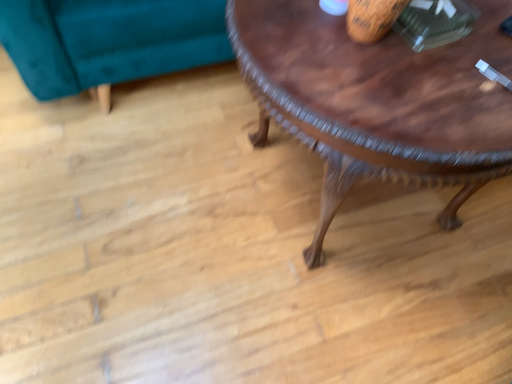
Question: Should I look upward or downward to see wooden carved coffee table at center?

Choices:
 (A) down
 (B) up

Answer: (B)

Question: Considering the relative sizes of wooden carved coffee table at center and teal velvet swivel chair at upper left in the image provided, is wooden carved coffee table at center taller than teal velvet swivel chair at upper left?

Choices:
 (A) yes
 (B) no

Answer: (A)

Question: Is wooden carved coffee table at center looking in the opposite direction of teal velvet swivel chair at upper left?

Choices:
 (A) no
 (B) yes

Answer: (B)

Question: Is wooden carved coffee table at center at the left side of teal velvet swivel chair at upper left?

Choices:
 (A) yes
 (B) no

Answer: (B)

Question: From a real-world perspective, is wooden carved coffee table at center under teal velvet swivel chair at upper left?

Choices:
 (A) no
 (B) yes

Answer: (A)

Question: Could you tell me if wooden carved coffee table at center is turned towards teal velvet swivel chair at upper left?

Choices:
 (A) yes
 (B) no

Answer: (B)

Question: Does wooden carved coffee table at center have a lesser height compared to teal velvet swivel chair at upper left?

Choices:
 (A) yes
 (B) no

Answer: (B)

Question: Is teal velvet swivel chair at upper left turned away from wooden carved coffee table at center?

Choices:
 (A) no
 (B) yes

Answer: (A)

Question: Is the position of teal velvet swivel chair at upper left more distant than that of wooden carved coffee table at center?

Choices:
 (A) no
 (B) yes

Answer: (B)

Question: Is teal velvet swivel chair at upper left taller than wooden carved coffee table at center?

Choices:
 (A) no
 (B) yes

Answer: (A)

Question: Does teal velvet swivel chair at upper left turn towards wooden carved coffee table at center?

Choices:
 (A) no
 (B) yes

Answer: (B)

Question: Does teal velvet swivel chair at upper left appear on the left side of wooden carved coffee table at center?

Choices:
 (A) no
 (B) yes

Answer: (B)

Question: Is teal velvet swivel chair at upper left bigger than wooden carved coffee table at center?

Choices:
 (A) yes
 (B) no

Answer: (B)

Question: Does point (12, 29) appear closer or farther from the camera than point (449, 110)?

Choices:
 (A) farther
 (B) closer

Answer: (A)